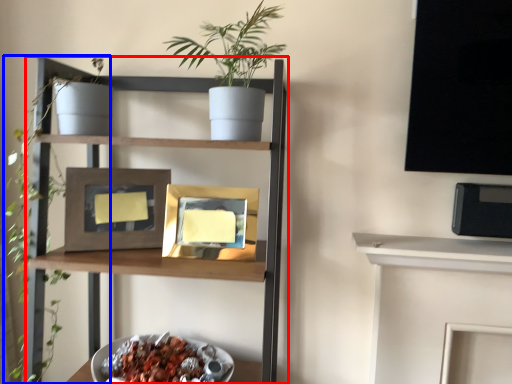
Question: Which object appears closest to the camera in this image, shelf (highlighted by a red box) or plant (highlighted by a blue box)?

Choices:
 (A) shelf
 (B) plant

Answer: (A)